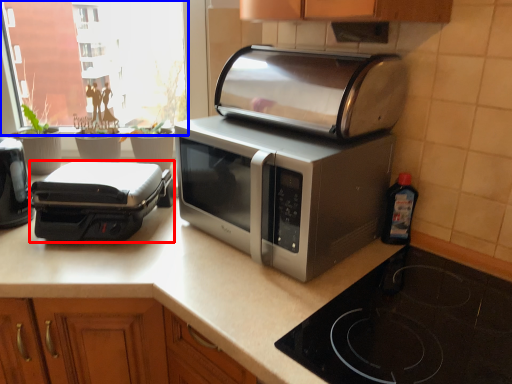
Question: Which object is closer to the camera taking this photo, toaster (highlighted by a red box) or window screen (highlighted by a blue box)?

Choices:
 (A) toaster
 (B) window screen

Answer: (A)